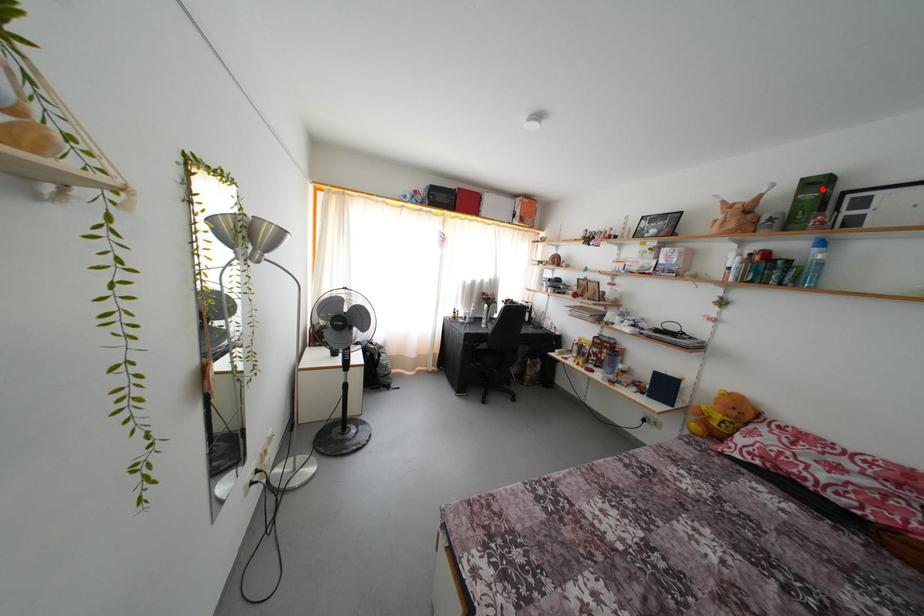
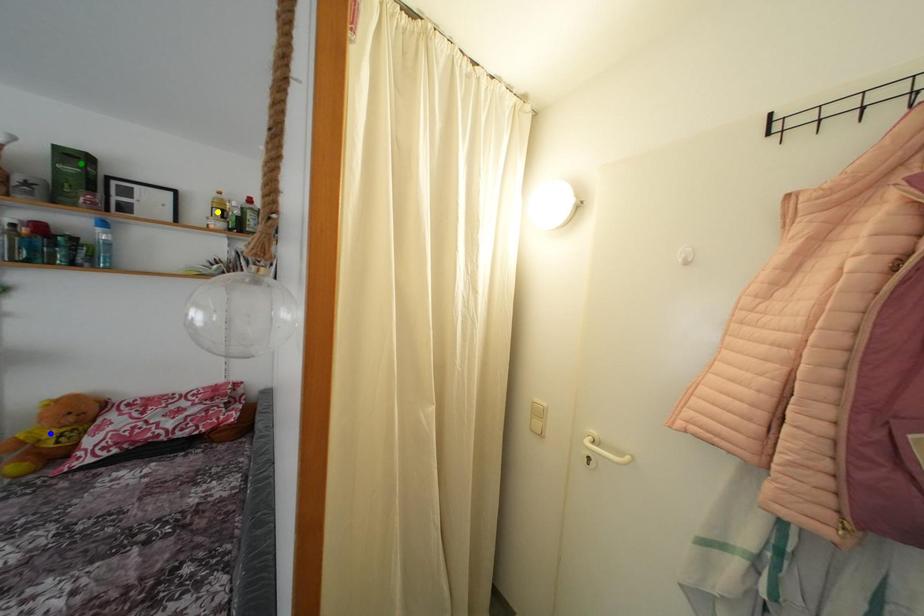
Question: I am providing you with two images of the same scene from different viewpoints. A red point is marked on the first image. You are given multiple points on the second image. Which spot in image 2 lines up with the point in image 1?

Choices:
 (A) yellow point
 (B) green point
 (C) blue point

Answer: (B)